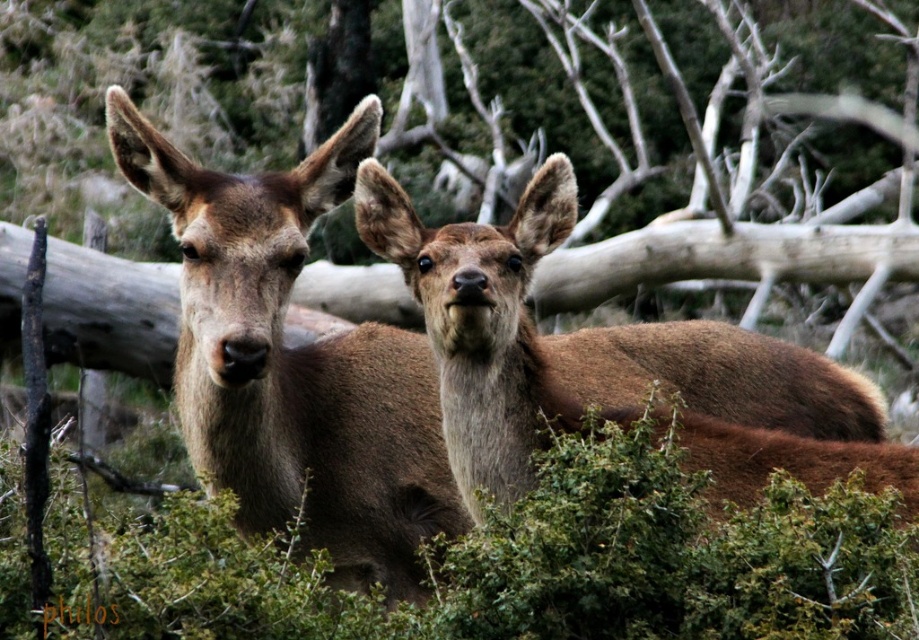
You are a wildlife photographer aiming to capture a closeup of the brown fur deer at center. Your camera has a zoom range that can focus on objects within a 0.5 unit radius from the point you select. If you choose to focus on the point at coordinates point (293, 364), will your camera be able to capture the brown fur deer at center clearly?

The point (293, 364) corresponds to the brown fur deer at center, so yes, focusing on that point will allow the camera to capture the brown fur deer at center clearly within the 0.5 unit radius.

You are a wildlife photographer aiming to capture a closeup shot of the brown fur deer at center. Your camera has a minimum focusing distance of 3 meters. Can you take the photo without moving closer?

The brown fur deer at center is 3.42 meters away from camera, which is beyond the minimum focusing distance of 3 meters. Therefore, you can take the closeup shot without moving closer.

You are a wildlife photographer aiming to capture a closeup shot of the deer. Which deer should you focus on to get the clearest image, the brown fur deer at center or the brown furry deer at center?

You should focus on the brown fur deer at center because it is closer to the viewer than the brown furry deer at center, allowing for a clearer closeup shot.